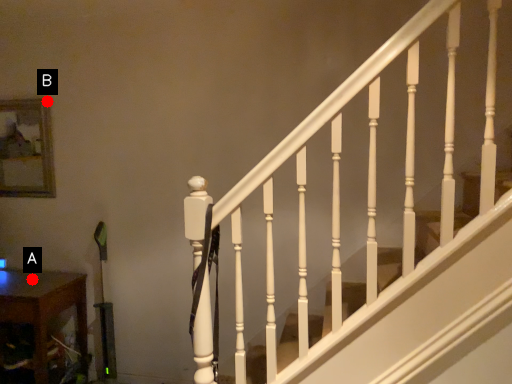
Question: Two points are circled on the image, labeled by A and B beside each circle. Which point appears closest to the camera in this image?

Choices:
 (A) A is closer
 (B) B is closer

Answer: (A)